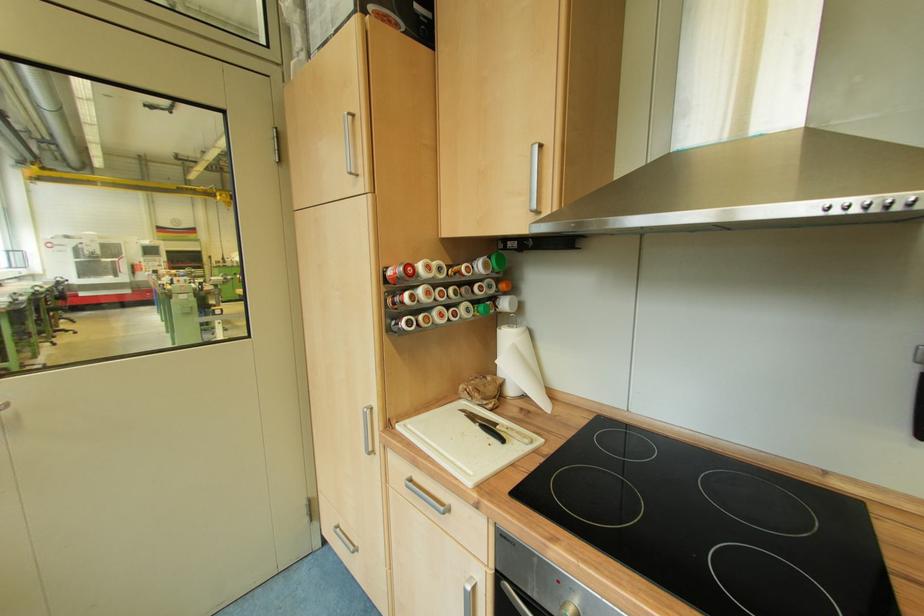
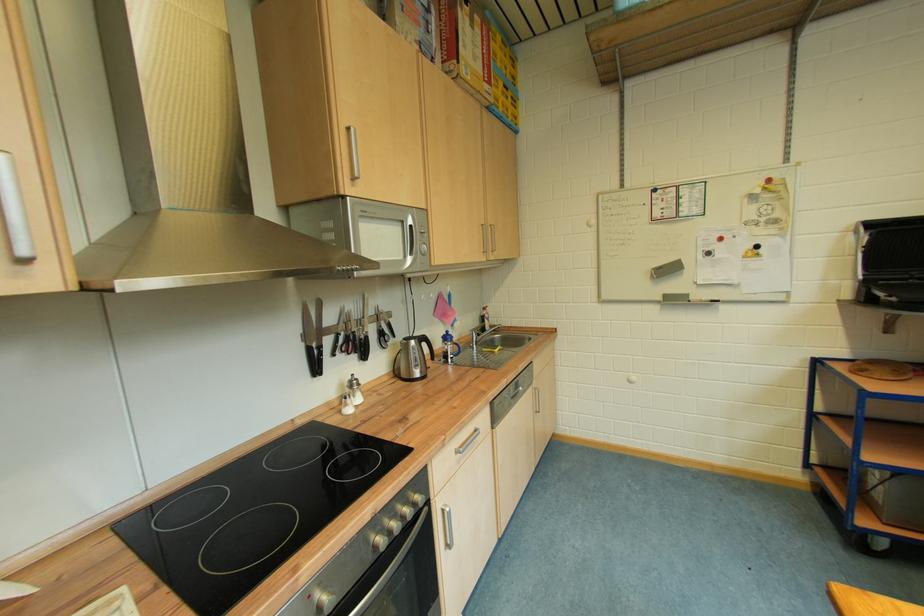
Question: How did the camera likely rotate?

Choices:
 (A) Left
 (B) Right
 (C) Up
 (D) Down

Answer: (B)